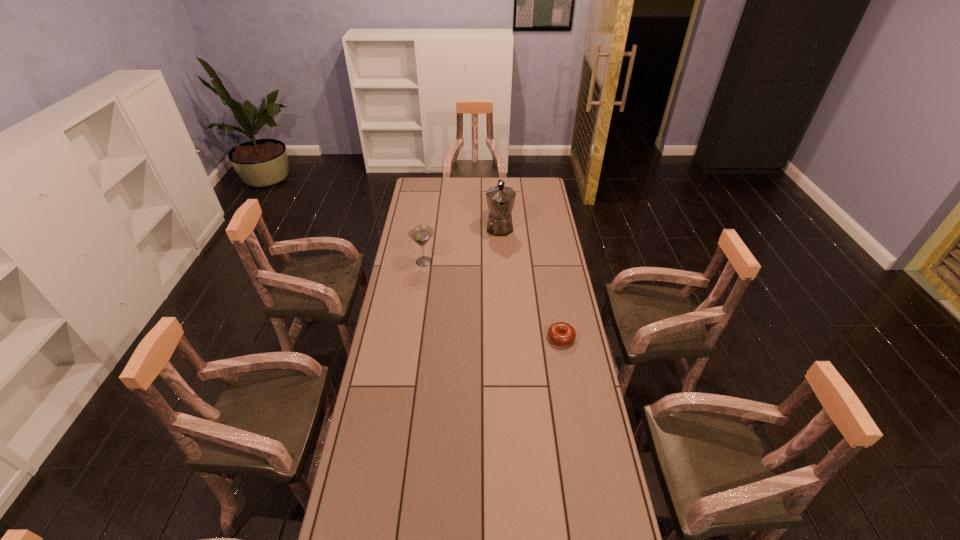
Locate which object is the closest to the tallest object. Please provide its 2D coordinates. Your answer should be formatted as a tuple, i.e. [(x, y)], where the tuple contains the x and y coordinates of a point satisfying the conditions above.

[(421, 234)]

Locate an element on the screen. Image resolution: width=960 pixels, height=540 pixels. blank area in the image that satisfies the following two spatial constraints: 1. on the pouring side of the tallest object; 2. on the right side of the shortest object is located at coordinates (506, 338).

The image size is (960, 540). Find the location of `vacant space that satisfies the following two spatial constraints: 1. on the front side of the leftmost object; 2. on the left side of the nearest object`. vacant space that satisfies the following two spatial constraints: 1. on the front side of the leftmost object; 2. on the left side of the nearest object is located at coordinates (413, 338).

Where is `free spot that satisfies the following two spatial constraints: 1. on the pouring side of the doughnut; 2. on the left side of the second object from left to right`? free spot that satisfies the following two spatial constraints: 1. on the pouring side of the doughnut; 2. on the left side of the second object from left to right is located at coordinates (506, 338).